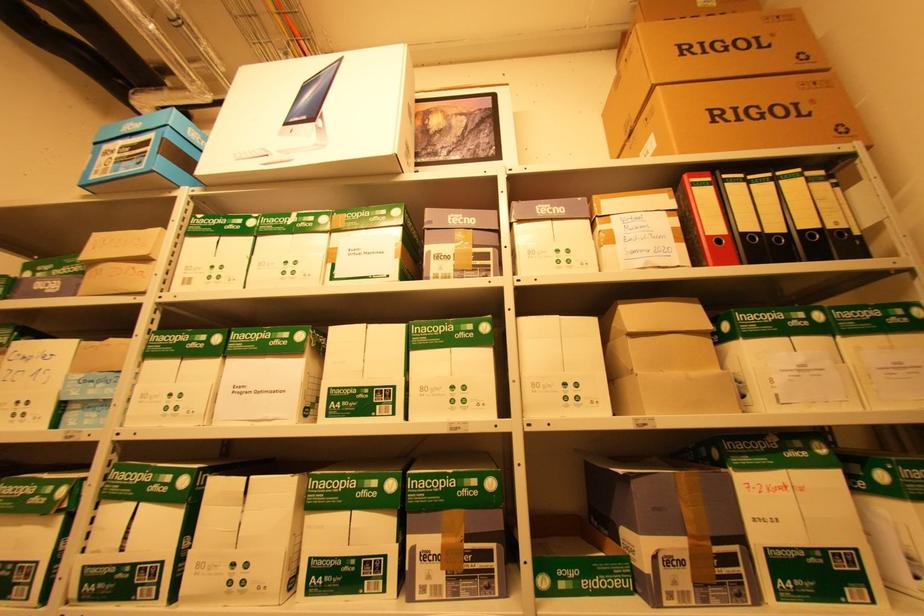
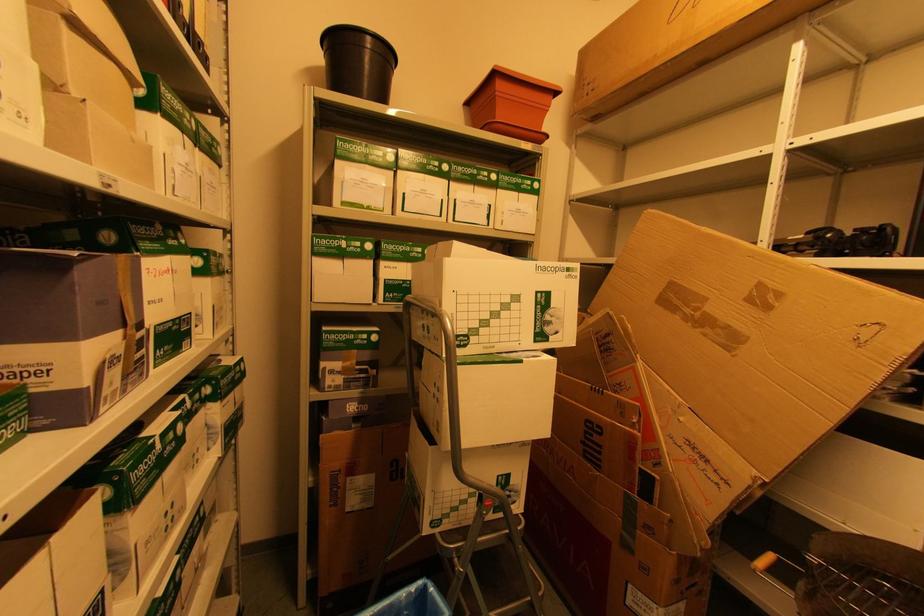
Question: The first image is from the beginning of the video and the second image is from the end. How did the camera likely rotate when shooting the video?

Choices:
 (A) Left
 (B) Right
 (C) Up
 (D) Down

Answer: (B)